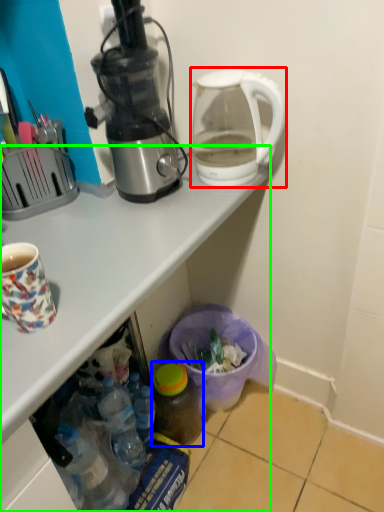
Question: Which object is the farthest from kettle (highlighted by a red box)? Choose among these: bottle (highlighted by a blue box) or desk (highlighted by a green box).

Choices:
 (A) bottle
 (B) desk

Answer: (A)